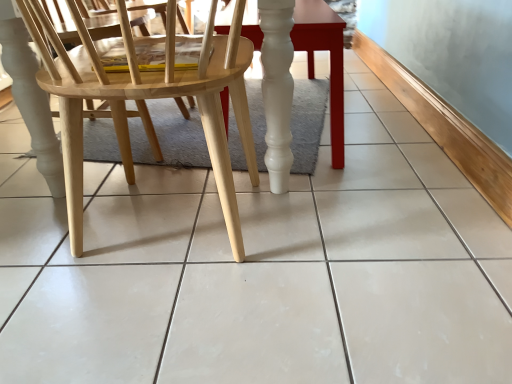
Where is `free space that is to the left of natural wood chair at left`? The image size is (512, 384). free space that is to the left of natural wood chair at left is located at coordinates (35, 222).